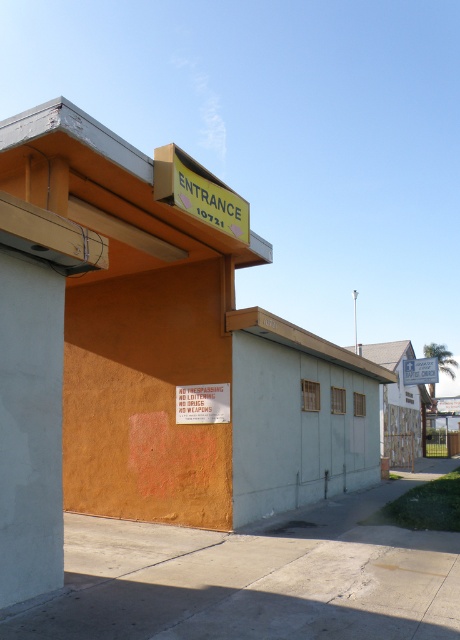
Is white concrete pillar at left to the right of white plastic sign at center from the viewer's perspective?

No, white concrete pillar at left is not to the right of white plastic sign at center.

Does white concrete pillar at left have a larger size compared to white plastic sign at center?

Incorrect, white concrete pillar at left is not larger than white plastic sign at center.

Is point (3, 275) closer to camera compared to point (420, 362)?

Yes, it is in front of point (420, 362).

Find the location of a particular element. This screenshot has width=460, height=640. white concrete pillar at left is located at coordinates (29, 428).

Is white concrete pillar at left shorter than yellow matte sign at upper center?

No.

Is point (27, 412) in front of point (178, 172)?

Yes, it is.

Is point (35, 444) positioned after point (224, 214)?

No, (35, 444) is closer to viewer.

Where is `white concrete pillar at left`? white concrete pillar at left is located at coordinates (29, 428).

Does yellow matte sign at upper center have a lesser height compared to white plastic sign at center?

In fact, yellow matte sign at upper center may be taller than white plastic sign at center.

Does yellow matte sign at upper center appear over white plastic sign at center?

Yes, yellow matte sign at upper center is above white plastic sign at center.

The image size is (460, 640). In order to click on yellow matte sign at upper center in this screenshot , I will do `click(199, 193)`.